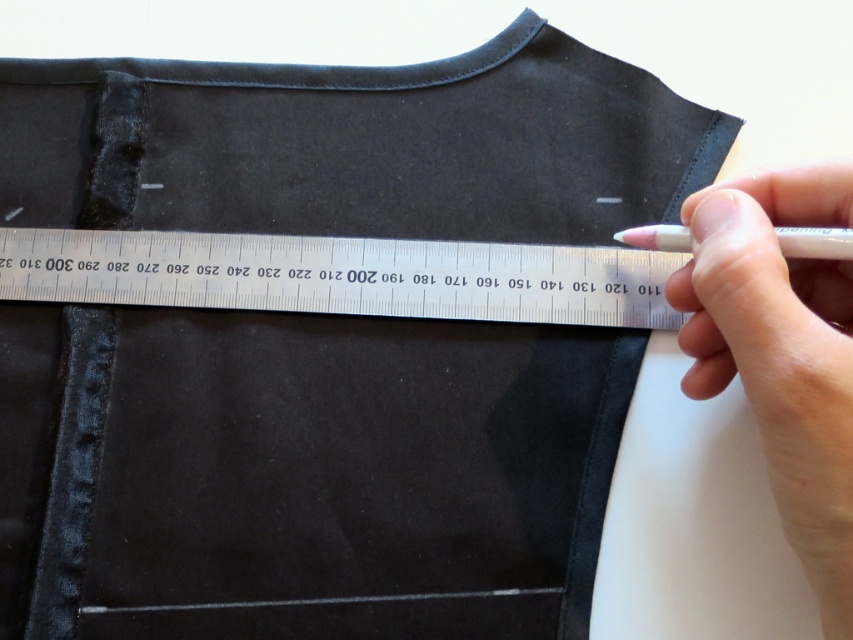
Question: Which object appears closest to the camera in this image?

Choices:
 (A) pink plastic pen at upper right
 (B) metallic silver ruler at center

Answer: (A)

Question: Where is metallic silver ruler at center located in relation to white matte pen at upper right in the image?

Choices:
 (A) right
 (B) left

Answer: (B)

Question: Is metallic silver ruler at center closer to camera compared to pink plastic pen at upper right?

Choices:
 (A) yes
 (B) no

Answer: (B)

Question: Estimate the real-world distances between objects in this image. Which object is farther from the pink plastic pen at upper right?

Choices:
 (A) white matte pen at upper right
 (B) metallic silver ruler at center

Answer: (B)

Question: Is pink plastic pen at upper right thinner than white matte pen at upper right?

Choices:
 (A) no
 (B) yes

Answer: (A)

Question: Which of these objects is positioned farthest from the pink plastic pen at upper right?

Choices:
 (A) white matte pen at upper right
 (B) metallic silver ruler at center

Answer: (B)